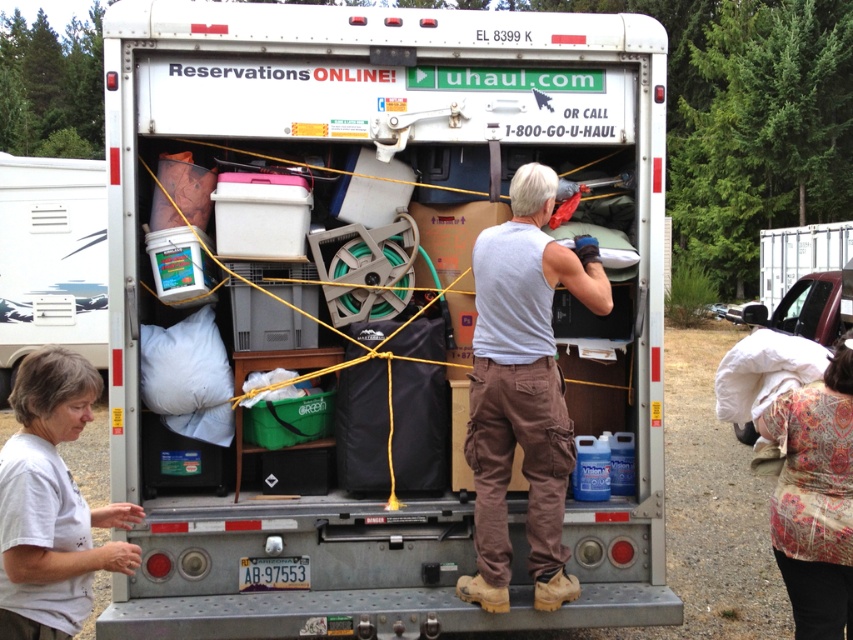
Question: Is metallic silver truck at center positioned at the back of white cotton shirt at lower left?

Choices:
 (A) no
 (B) yes

Answer: (B)

Question: Which object is closer to the camera taking this photo?

Choices:
 (A) metallic silver truck at center
 (B) white cotton shirt at lower left

Answer: (B)

Question: Estimate the real-world distances between objects in this image. Which object is farther from the white cotton shirt at lower left?

Choices:
 (A) metallic silver truck at center
 (B) floral-patterned fabric at lower right
 (C) gray cotton tank top at center

Answer: (B)

Question: Which of the following is the farthest from the observer?

Choices:
 (A) white cotton shirt at lower left
 (B) metallic silver truck at center

Answer: (B)

Question: In this image, where is metallic silver truck at center located relative to white cotton shirt at lower left?

Choices:
 (A) right
 (B) left

Answer: (A)

Question: Does metallic silver truck at center have a larger size compared to gray cotton tank top at center?

Choices:
 (A) no
 (B) yes

Answer: (B)